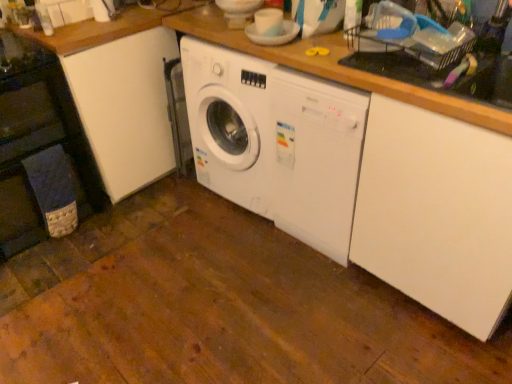
The width and height of the screenshot is (512, 384). Find the location of `white matte washing machine at center`. white matte washing machine at center is located at coordinates (276, 142).

What do you see at coordinates (276, 142) in the screenshot? Image resolution: width=512 pixels, height=384 pixels. I see `white matte washing machine at center` at bounding box center [276, 142].

The width and height of the screenshot is (512, 384). In order to click on white matte washing machine at center in this screenshot , I will do `click(276, 142)`.